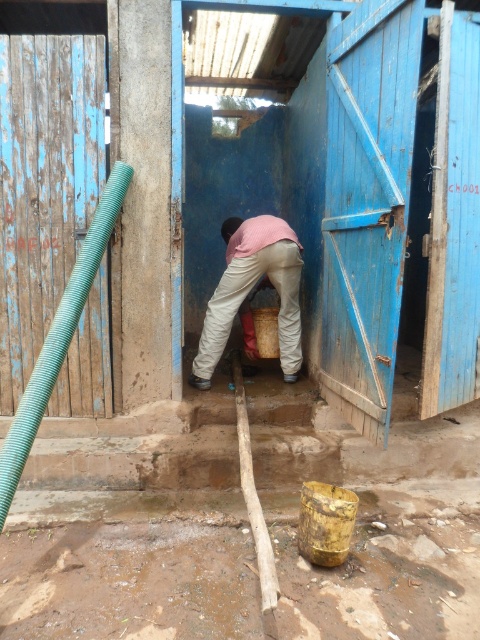
Question: Is brown clay mud at lower center to the left of green corrugated pipe at left from the viewer's perspective?

Choices:
 (A) no
 (B) yes

Answer: (A)

Question: Is pink fabric at center thinner than green corrugated pipe at left?

Choices:
 (A) yes
 (B) no

Answer: (B)

Question: Considering the real-world distances, which object is farthest from the pink fabric at center?

Choices:
 (A) green corrugated pipe at left
 (B) brown clay mud at lower center

Answer: (B)

Question: Which point is farther to the camera?

Choices:
 (A) brown clay mud at lower center
 (B) pink fabric at center
 (C) green corrugated pipe at left

Answer: (B)

Question: Which object appears closest to the camera in this image?

Choices:
 (A) pink fabric at center
 (B) green corrugated pipe at left

Answer: (B)

Question: Does pink fabric at center appear over green corrugated pipe at left?

Choices:
 (A) yes
 (B) no

Answer: (A)